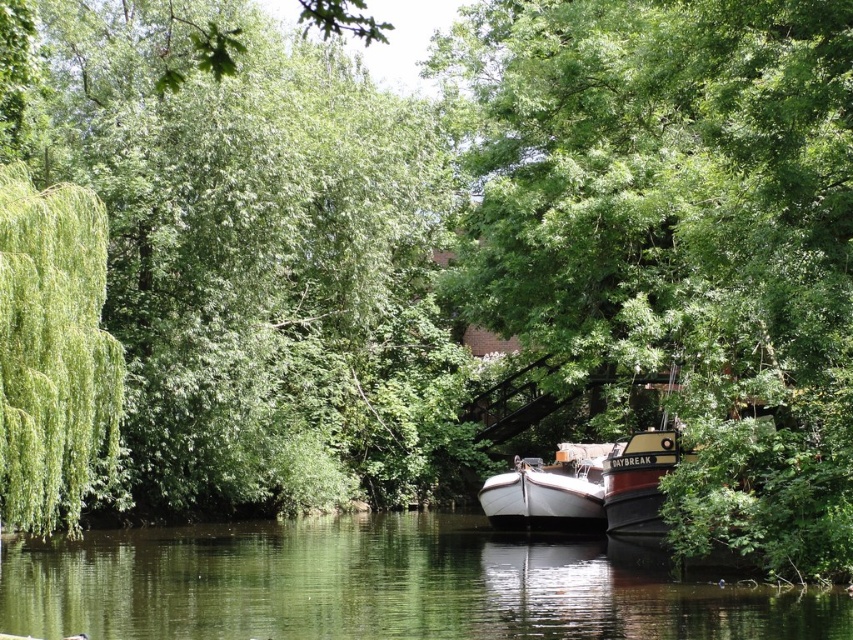
Is green smooth water at center positioned behind white matte boat at center?

No, green smooth water at center is closer to the viewer.

Who is higher up, green smooth water at center or white matte boat at center?

Positioned higher is white matte boat at center.

Between point (599, 620) and point (598, 506), which one is positioned in front?

Point (599, 620)

Image resolution: width=853 pixels, height=640 pixels. Find the location of `green smooth water at center`. green smooth water at center is located at coordinates (379, 586).